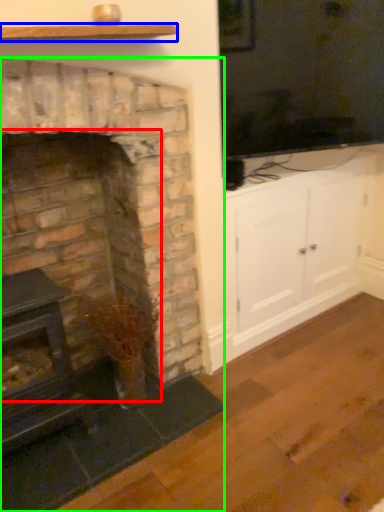
Question: Estimate the real-world distances between objects in this image. Which object is closer to fireplace (highlighted by a red box), shelf (highlighted by a blue box) or fireplace (highlighted by a green box)?

Choices:
 (A) shelf
 (B) fireplace

Answer: (B)